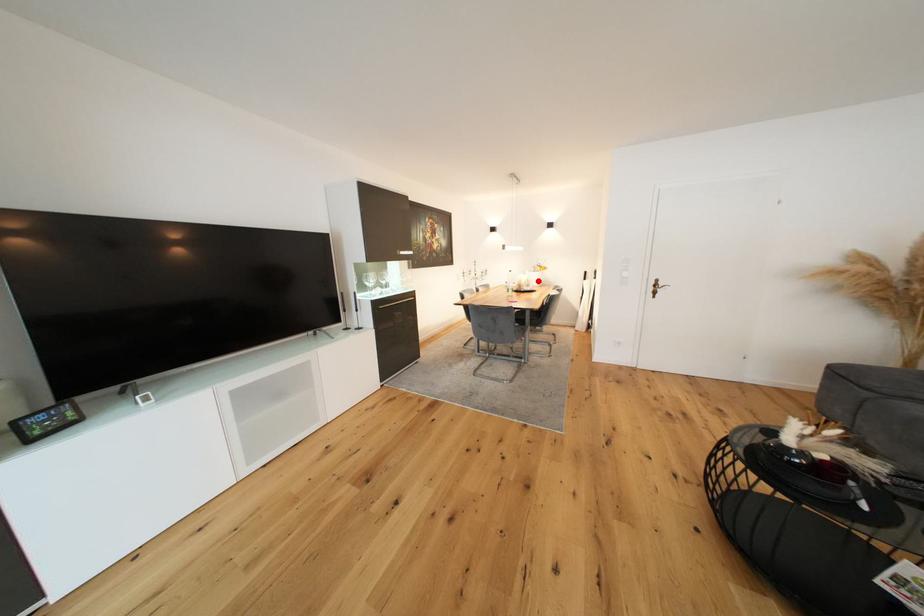
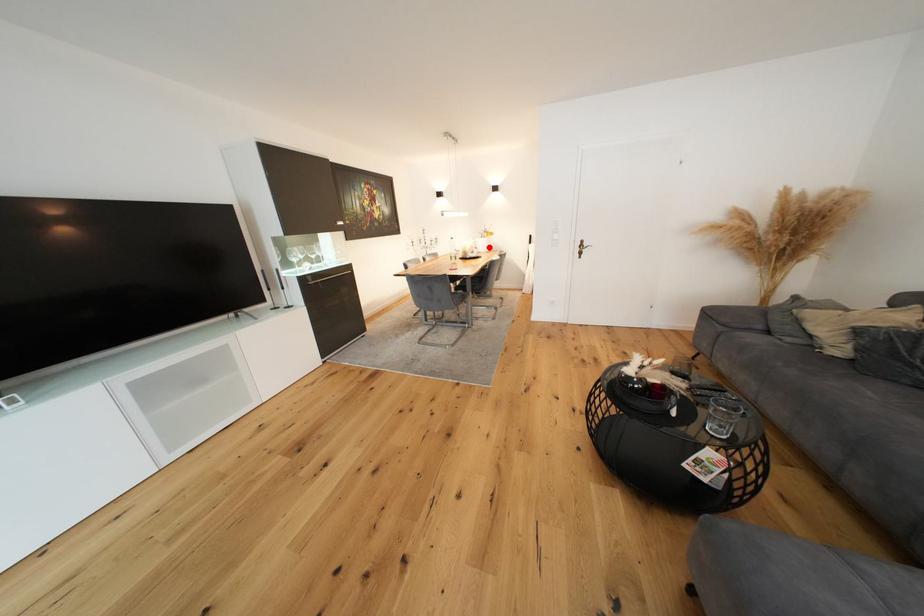
I am providing you with two images of the same scene from different viewpoints. A red point is marked on the first image and another point is marked on the second image. Do the highlighted points in image1 and image2 indicate the same real-world spot?

Yes